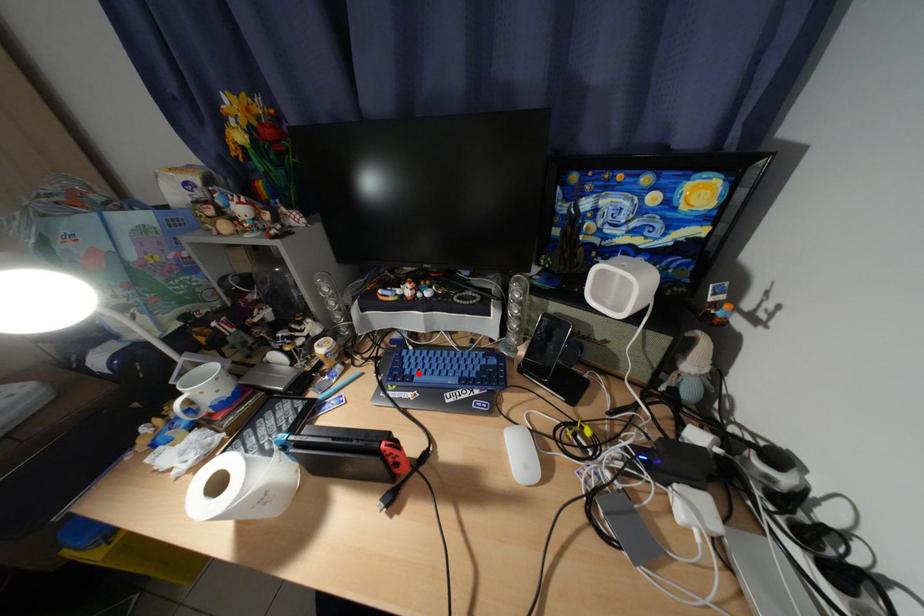
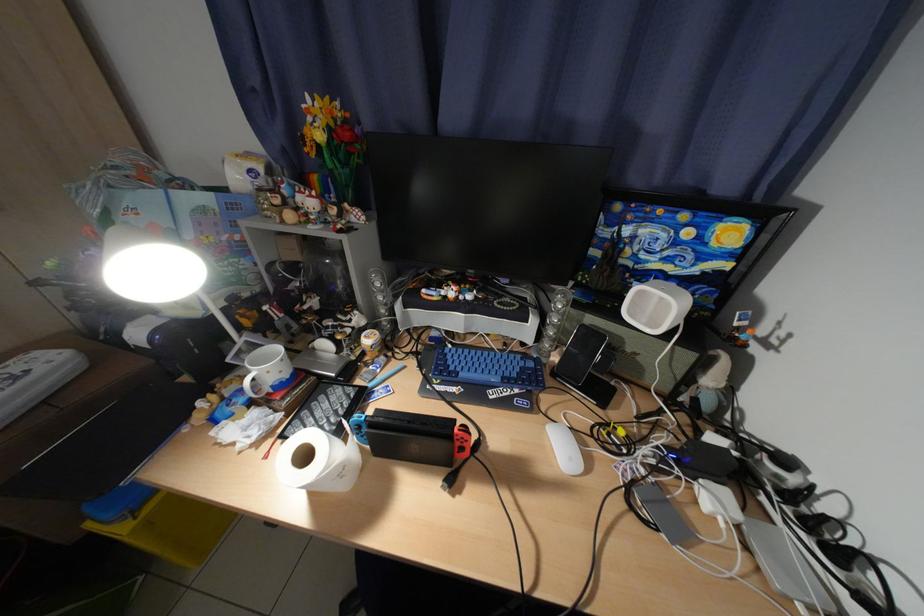
Find the pixel in the second image that matches the highlighted location in the first image.

(464, 370)